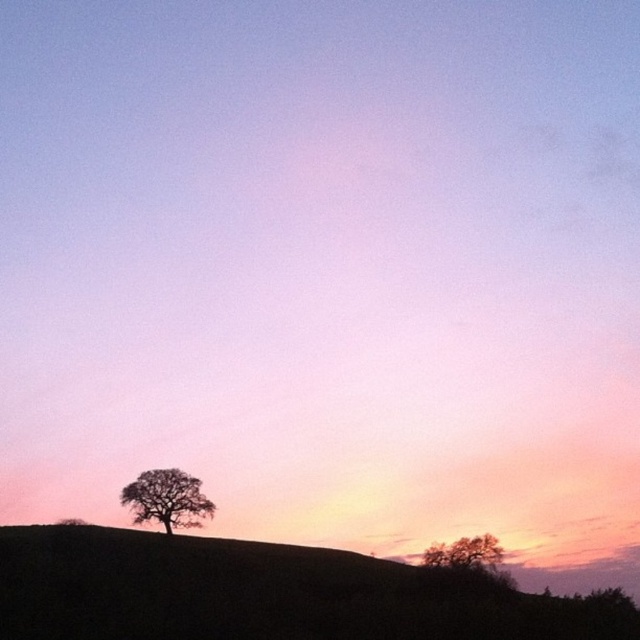
Question: Does silhouette grass at lower left have a lesser width compared to silhouette leafy tree at lower left?

Choices:
 (A) no
 (B) yes

Answer: (A)

Question: Is silhouette grass at lower left to the right of silhouette leafy tree at lower left from the viewer's perspective?

Choices:
 (A) no
 (B) yes

Answer: (B)

Question: Which of these objects is positioned farthest from the smooth brown tree at lower right?

Choices:
 (A) silhouette leafy tree at lower left
 (B) silhouette grass at lower left

Answer: (A)

Question: Which of the following is the closest to the observer?

Choices:
 (A) (172, 524)
 (B) (476, 536)
 (C) (218, 556)

Answer: (C)

Question: Which object is closer to the camera taking this photo?

Choices:
 (A) smooth brown tree at lower right
 (B) silhouette grass at lower left

Answer: (B)

Question: Does silhouette grass at lower left have a smaller size compared to silhouette leafy tree at lower left?

Choices:
 (A) no
 (B) yes

Answer: (A)